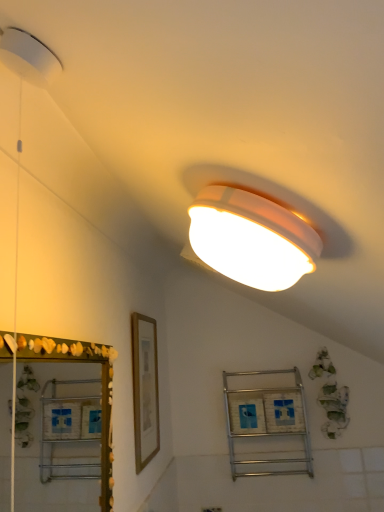
Question: In terms of size, does metallic silver shelf at center appear bigger or smaller than gold wooden picture frame at center-left?

Choices:
 (A) small
 (B) big

Answer: (B)

Question: In the image, is metallic silver shelf at center on the left side or the right side of gold wooden picture frame at center-left?

Choices:
 (A) right
 (B) left

Answer: (A)

Question: Considering the real-world distances, which object is closest to the white plastic electric outlet at lower center?

Choices:
 (A) gold wooden picture frame at center-left
 (B) metallic silver shelf at center
 (C) green shell mirror at left

Answer: (B)

Question: Based on their relative distances, which object is nearer to the white plastic electric outlet at lower center?

Choices:
 (A) metallic silver shelf at center
 (B) gold wooden picture frame at center-left
 (C) green shell mirror at left

Answer: (A)